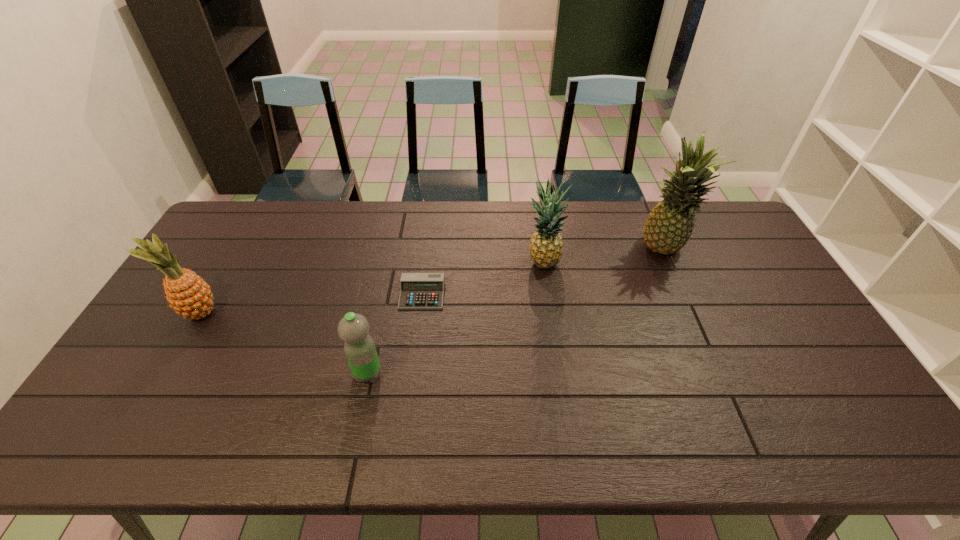
At what (x,y) coordinates should I click in order to perform the action: click on the rightmost object. Please return your answer as a coordinate pair (x, y). The width and height of the screenshot is (960, 540). Looking at the image, I should click on (669, 226).

Locate an element on the screen. the tallest object is located at coordinates (669, 226).

In order to click on the second object from right to left in this screenshot , I will do `click(546, 245)`.

Identify the location of the nearest pineapple. (190, 296).

Locate an element on the screen. The width and height of the screenshot is (960, 540). the leftmost object is located at coordinates (190, 296).

Where is `the second object from left to right`? The width and height of the screenshot is (960, 540). the second object from left to right is located at coordinates (353, 328).

The image size is (960, 540). I want to click on water bottle, so click(353, 328).

Identify the location of calculator. This screenshot has height=540, width=960. (417, 290).

Find the location of a particular element. Image resolution: width=960 pixels, height=540 pixels. the shortest object is located at coordinates (417, 290).

The height and width of the screenshot is (540, 960). Identify the location of free spot located on the front of the tallest object. (703, 342).